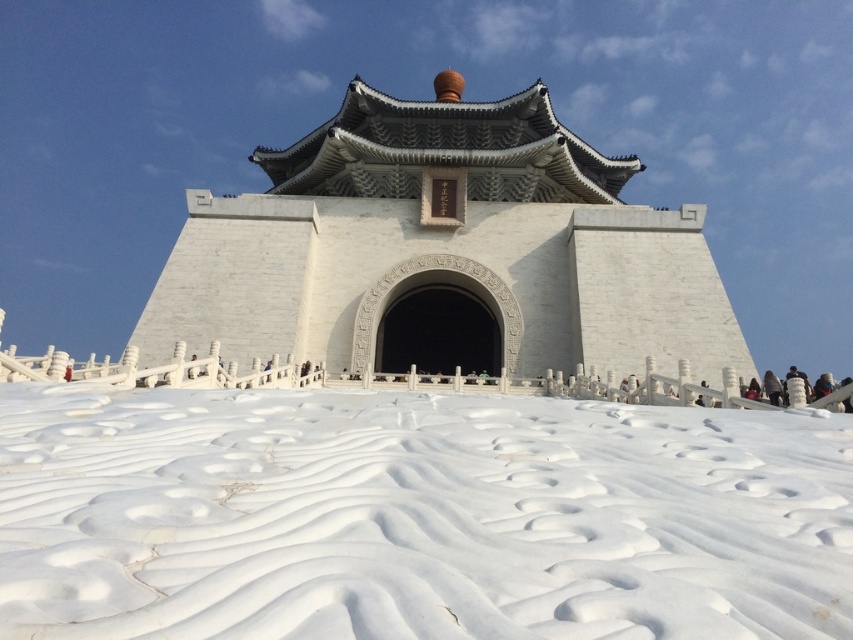
Question: Does white textured snow at lower center appear under white stone temple at center?

Choices:
 (A) no
 (B) yes

Answer: (B)

Question: Is white textured snow at lower center positioned behind white stone temple at center?

Choices:
 (A) yes
 (B) no

Answer: (B)

Question: Which object is closer to the camera taking this photo?

Choices:
 (A) white textured snow at lower center
 (B) white stone temple at center

Answer: (A)

Question: Which point is closer to the camera?

Choices:
 (A) white textured snow at lower center
 (B) white stone temple at center

Answer: (A)

Question: Observing the image, what is the correct spatial positioning of white textured snow at lower center in reference to white stone temple at center?

Choices:
 (A) below
 (B) above

Answer: (A)